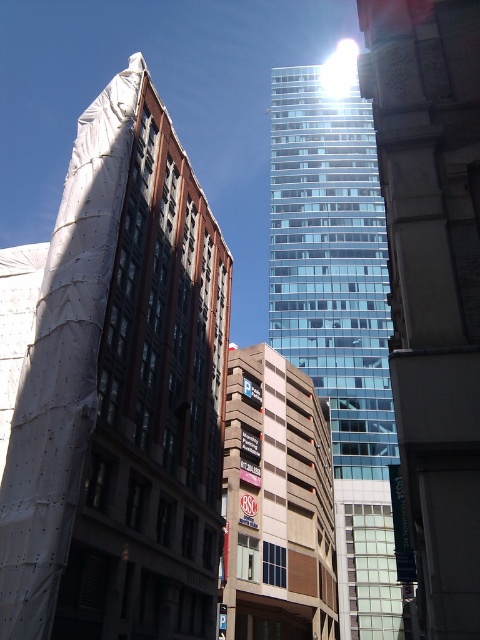
Question: Which point is farther from the camera taking this photo?

Choices:
 (A) (199, 634)
 (B) (330, 502)
 (C) (358, 202)
 (D) (429, 264)

Answer: (C)

Question: Which of the following is the farthest from the observer?

Choices:
 (A) (421, 61)
 (B) (142, 529)

Answer: (B)

Question: Is transparent glass tower at center above brown brick building at center?

Choices:
 (A) no
 (B) yes

Answer: (B)

Question: Which point is closer to the camera?

Choices:
 (A) (115, 76)
 (B) (466, 612)
 (C) (267, 572)

Answer: (B)

Question: Does white plastic building at left lie in front of transparent glass building at center?

Choices:
 (A) yes
 (B) no

Answer: (A)

Question: Observing the image, what is the correct spatial positioning of transparent glass tower at center in reference to transparent glass building at center?

Choices:
 (A) above
 (B) below

Answer: (B)